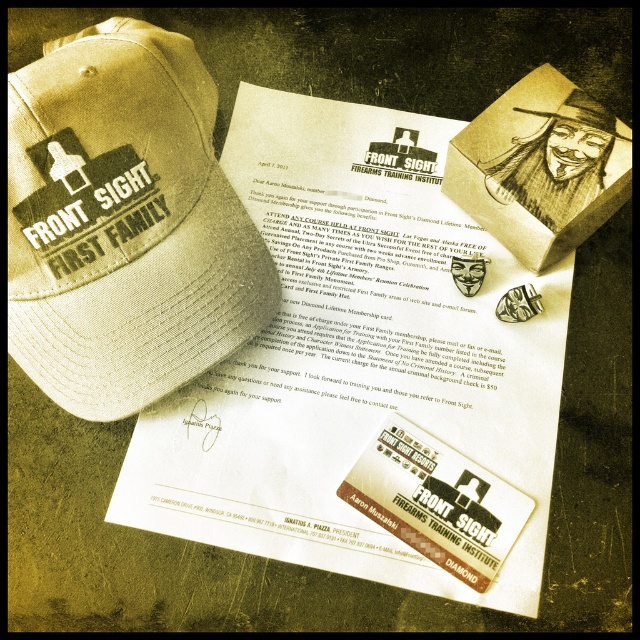
Question: Which point is farther to the camera?

Choices:
 (A) (378, 140)
 (B) (602, 120)

Answer: (A)

Question: In this image, where is white paper at center located relative to tan fabric baseball cap at upper left?

Choices:
 (A) left
 (B) right

Answer: (B)

Question: Where is white paper at center located in relation to tan fabric baseball cap at upper left in the image?

Choices:
 (A) left
 (B) right

Answer: (B)

Question: Is white paper at center wider than tan fabric baseball cap at upper left?

Choices:
 (A) no
 (B) yes

Answer: (B)

Question: Among these objects, which one is farthest from the camera?

Choices:
 (A) tan fabric baseball cap at upper left
 (B) matte khaki baseball cap at upper left

Answer: (B)

Question: Which point is farther to the camera?

Choices:
 (A) tan fabric baseball cap at upper left
 (B) white paper at center

Answer: (B)